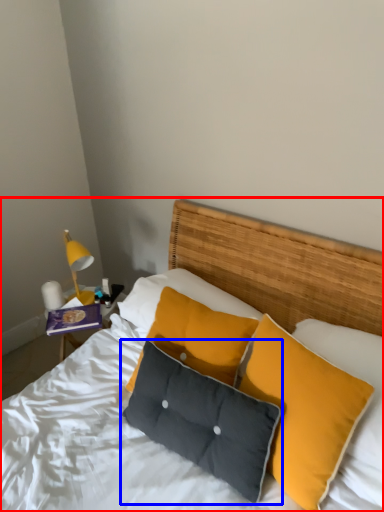
Question: Which point is closer to the camera, bed (highlighted by a red box) or pillow (highlighted by a blue box)?

Choices:
 (A) bed
 (B) pillow

Answer: (B)